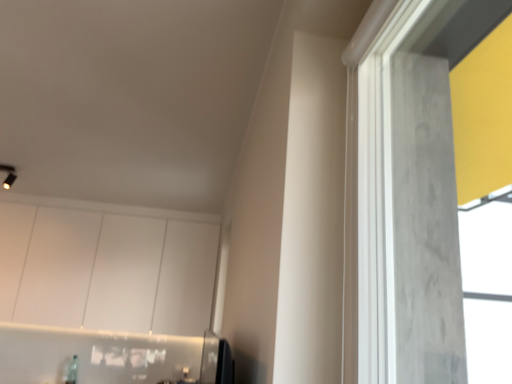
The image size is (512, 384). In order to click on white matte cabinet at upper left in this screenshot , I will do `click(106, 266)`.

Measure the distance between point (82, 303) and camera.

Point (82, 303) is 12.75 feet from camera.

Describe the element at coordinates (106, 266) in the screenshot. I see `white matte cabinet at upper left` at that location.

Locate an element on the screen. white matte cabinet at upper left is located at coordinates (106, 266).